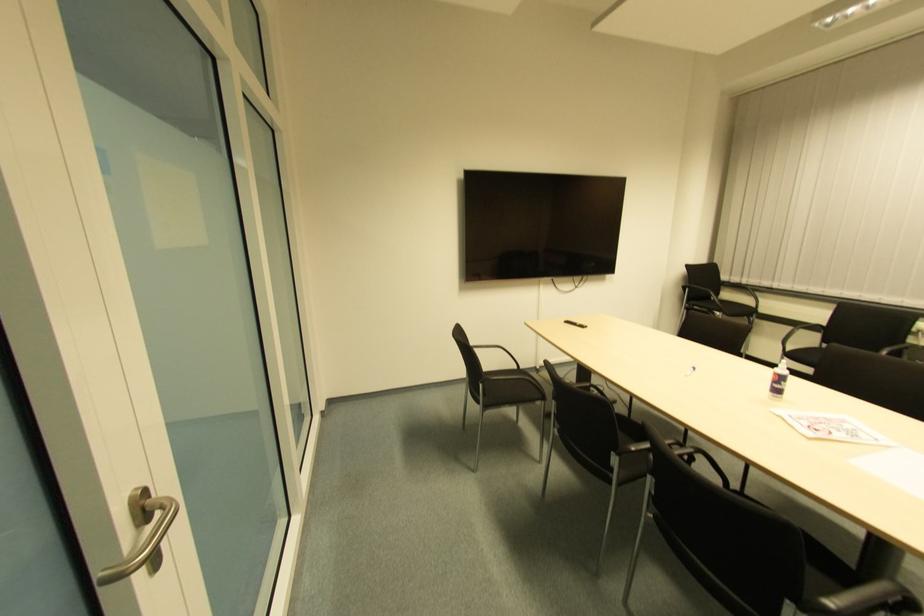
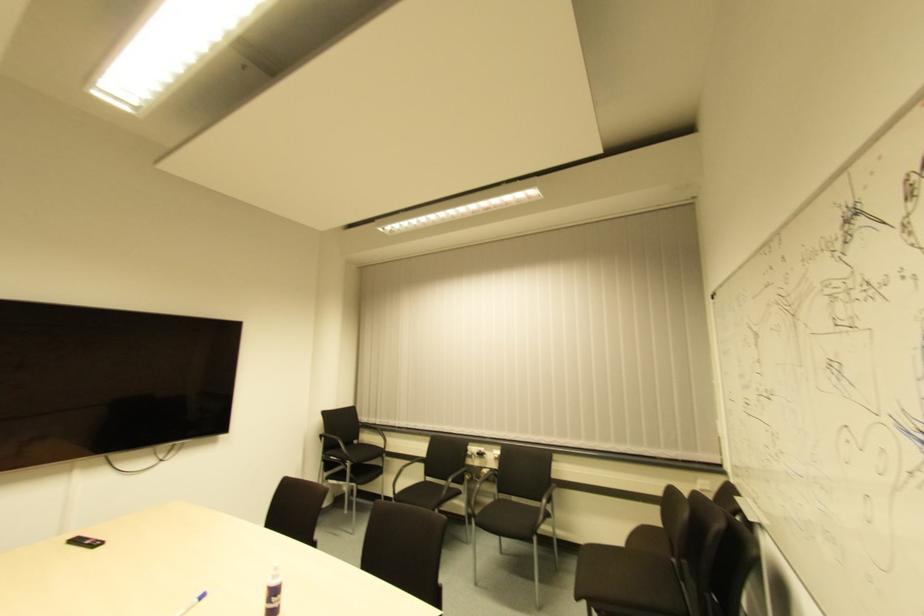
In the second image, find the point that corresponds to point (565, 325) in the first image.

(73, 543)